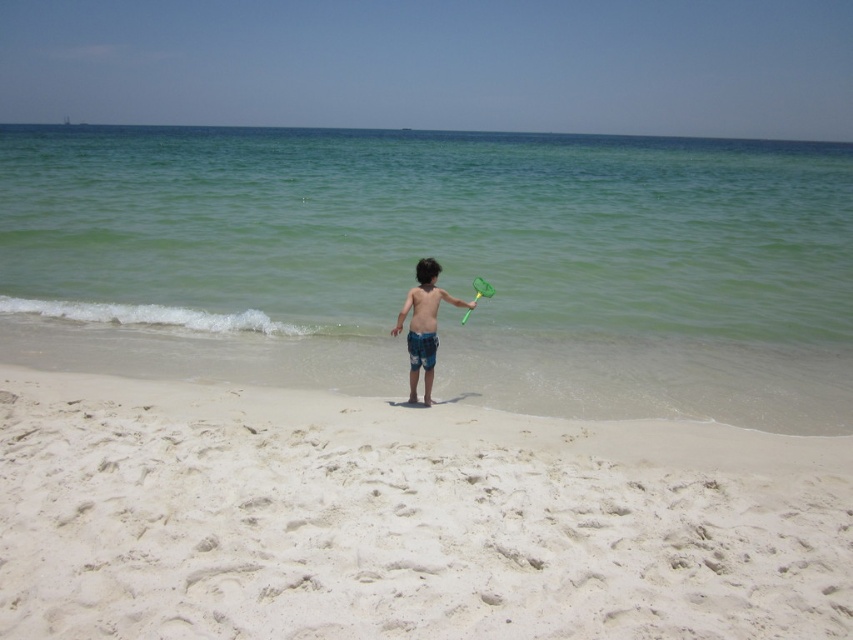
Question: Considering the real-world distances, which object is closest to the green plastic paddle at center?

Choices:
 (A) blue denim shorts at center
 (B) white sandy beach at center

Answer: (A)

Question: From the image, what is the correct spatial relationship of white sandy beach at center in relation to blue denim shorts at center?

Choices:
 (A) right
 (B) left

Answer: (A)

Question: Which point appears closest to the camera in this image?

Choices:
 (A) (506, 630)
 (B) (518, 227)
 (C) (407, 310)

Answer: (A)

Question: Is clear water at center below green plastic paddle at center?

Choices:
 (A) no
 (B) yes

Answer: (A)

Question: Can you confirm if blue denim shorts at center is positioned to the right of green plastic paddle at center?

Choices:
 (A) no
 (B) yes

Answer: (A)

Question: Which point is farther to the camera?

Choices:
 (A) clear water at center
 (B) blue denim shorts at center

Answer: (A)